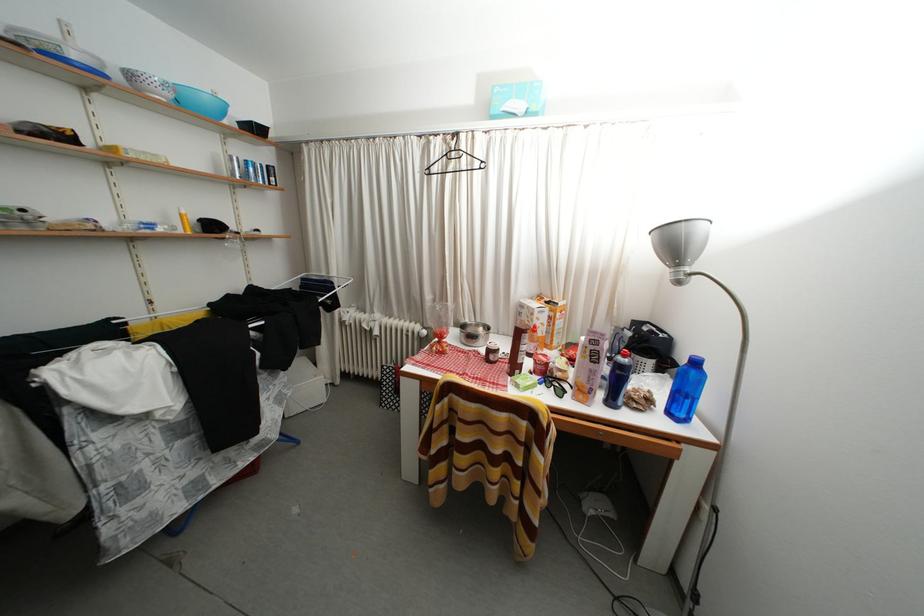
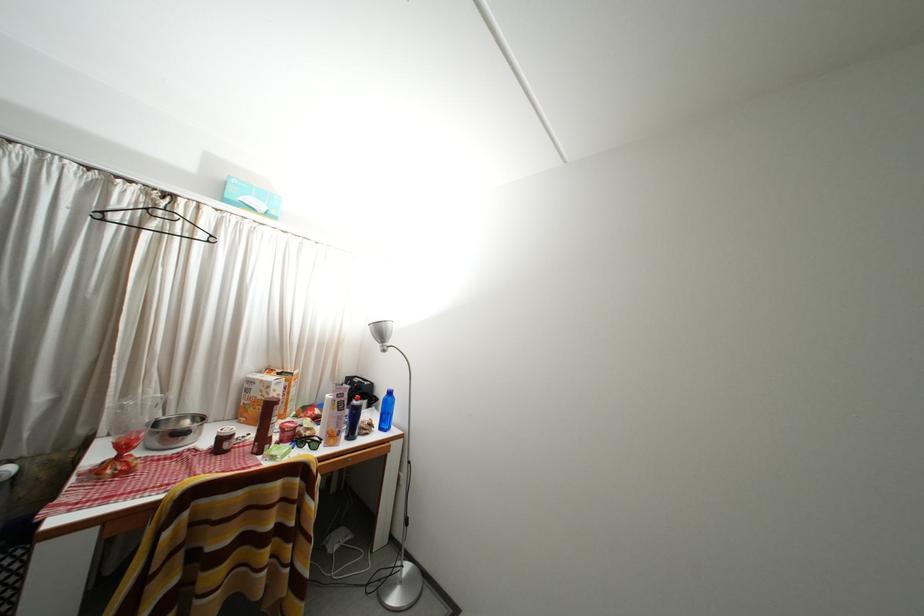
Locate, in the second image, the point that corresponds to pixel 529 310 in the first image.

(259, 387)